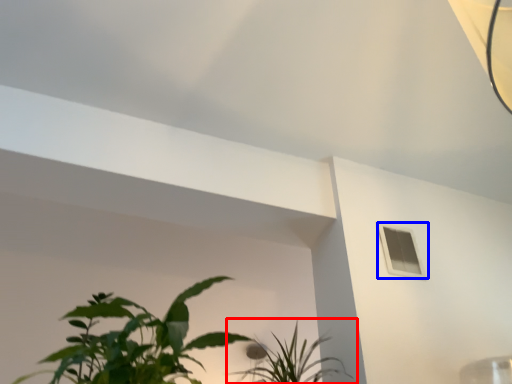
Question: Which of the following is the farthest to the observer, houseplant (highlighted by a red box) or window (highlighted by a blue box)?

Choices:
 (A) houseplant
 (B) window

Answer: (B)